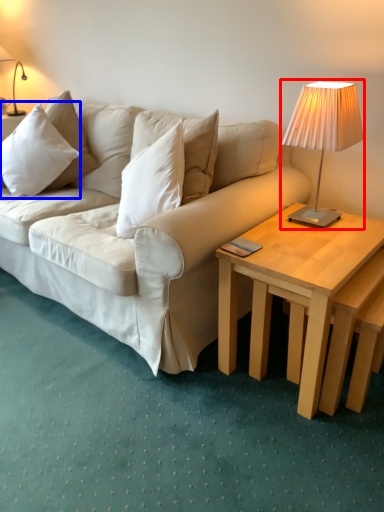
Question: Which point is further to the camera, lamp (highlighted by a red box) or pillow (highlighted by a blue box)?

Choices:
 (A) lamp
 (B) pillow

Answer: (B)